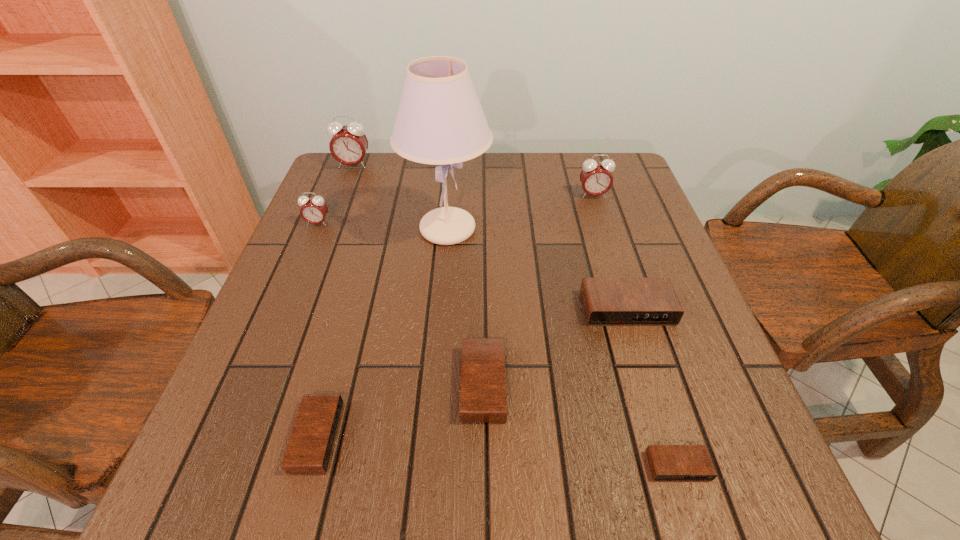
This screenshot has width=960, height=540. I want to click on free location at the left edge, so click(292, 246).

In order to click on free spot at the right edge of the desktop in this screenshot , I will do `click(638, 356)`.

This screenshot has height=540, width=960. In the image, there is a desktop. What are the coordinates of `vacant space at the far right corner` in the screenshot? It's located at pyautogui.click(x=621, y=165).

You are a GUI agent. You are given a task and a screenshot of the screen. Output one action in this format:
    pyautogui.click(x=<x>, y=<y>)
    Task: Click on the free point at the near right corner
    The image size is (960, 540).
    Given the screenshot: What is the action you would take?
    pyautogui.click(x=670, y=495)

Identify the location of vacant region between the tallest alarm clock and the leftmost black alarm clock. Image resolution: width=960 pixels, height=540 pixels. (335, 301).

Find the location of `vacant area that lies between the fourth tallest object and the tallest object`. vacant area that lies between the fourth tallest object and the tallest object is located at coordinates (383, 226).

This screenshot has width=960, height=540. Identify the location of free space between the second biggest black alarm clock and the smallest pink alarm clock. (400, 303).

The image size is (960, 540). Identify the location of free space that is in between the lampshade and the tallest alarm clock. (400, 197).

You are a GUI agent. You are given a task and a screenshot of the screen. Output one action in this format:
    pyautogui.click(x=<x>, y=<y>)
    Task: Click on the vacant space in between the seventh tallest object and the rightmost pink alarm clock
    Image resolution: width=960 pixels, height=540 pixels.
    Given the screenshot: What is the action you would take?
    point(455,316)

The height and width of the screenshot is (540, 960). In order to click on vacant space that's between the third shortest object and the sixth nearest alarm clock in this screenshot , I will do `click(539, 289)`.